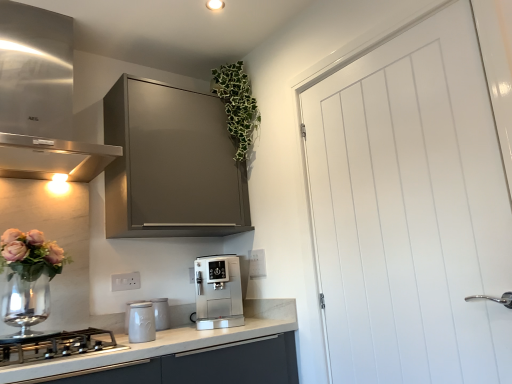
At what (x,y) coordinates should I click in order to perform the action: click on blank space situated above white smooth door at right (from a real-world perspective). Please return your answer as a coordinate pair (x, y). The image size is (512, 384). Looking at the image, I should click on (369, 45).